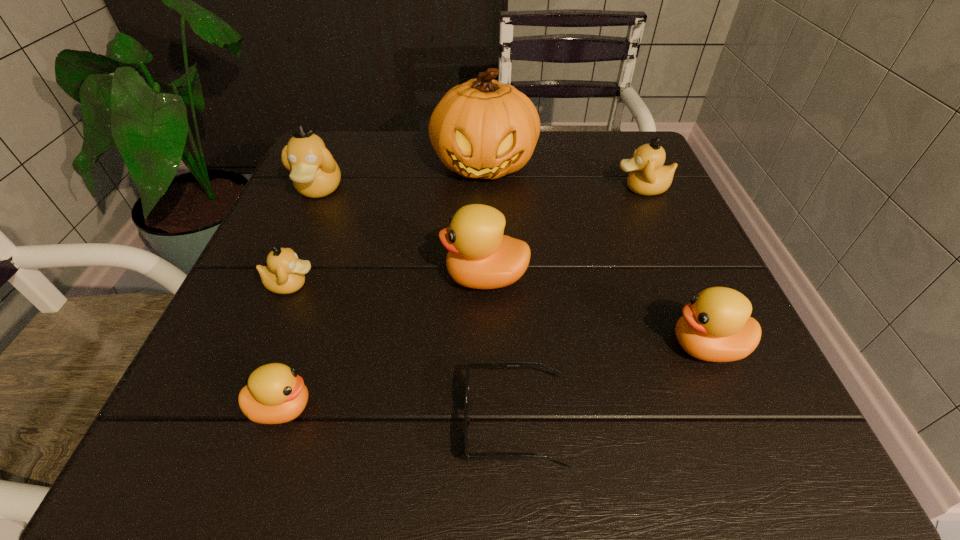
The height and width of the screenshot is (540, 960). What are the coordinates of `vacant space located on the face of the second smallest yellow duckling` in the screenshot? It's located at (620, 347).

Locate an element on the screen. The width and height of the screenshot is (960, 540). vacant space located on the face of the second smallest yellow duckling is located at coordinates (417, 347).

Locate an element on the screen. free space located 0.080m on the face of the second smallest yellow duckling is located at coordinates (614, 347).

Image resolution: width=960 pixels, height=540 pixels. I want to click on vacant point located on the face of the smallest tan duckling, so click(x=358, y=285).

Identify the location of vacant space situated 0.270m on the face of the nearest duckling. The width and height of the screenshot is (960, 540). tap(514, 408).

At what (x,y) coordinates should I click in order to perform the action: click on vacant region located 0.270m at the front lenses of the sunglasses. Please return your answer as a coordinate pair (x, y). The image size is (960, 540). Looking at the image, I should click on (262, 422).

The height and width of the screenshot is (540, 960). I want to click on vacant area located at the front lenses of the sunglasses, so click(180, 422).

Find the location of a particular element. The height and width of the screenshot is (540, 960). vacant space positioned 0.370m at the front lenses of the sunglasses is located at coordinates (187, 422).

At what (x,y) coordinates should I click in order to perform the action: click on pumpkin present at the far edge. Please return your answer as a coordinate pair (x, y). Looking at the image, I should click on pos(483,128).

Where is `duckling that is at the near edge`? This screenshot has width=960, height=540. duckling that is at the near edge is located at coordinates (275, 394).